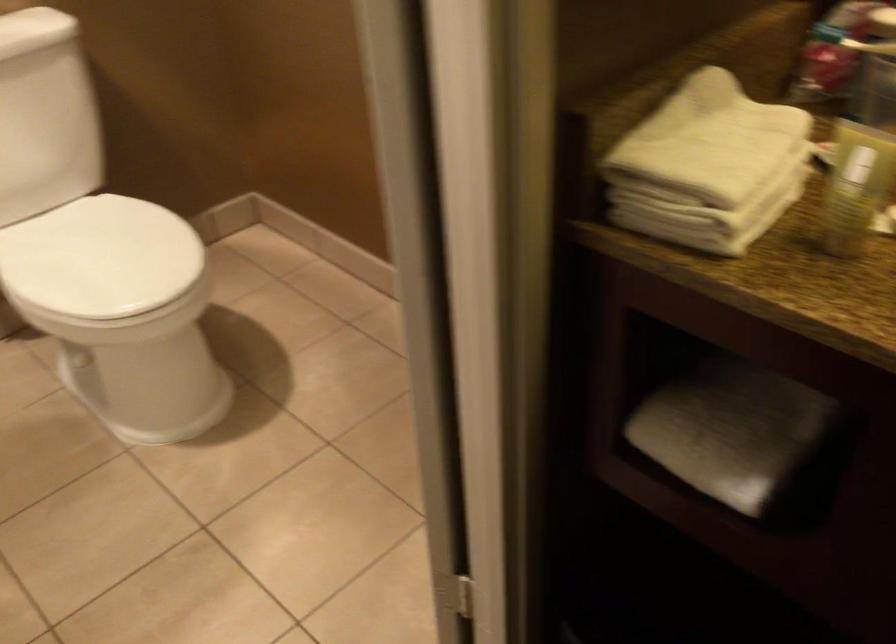
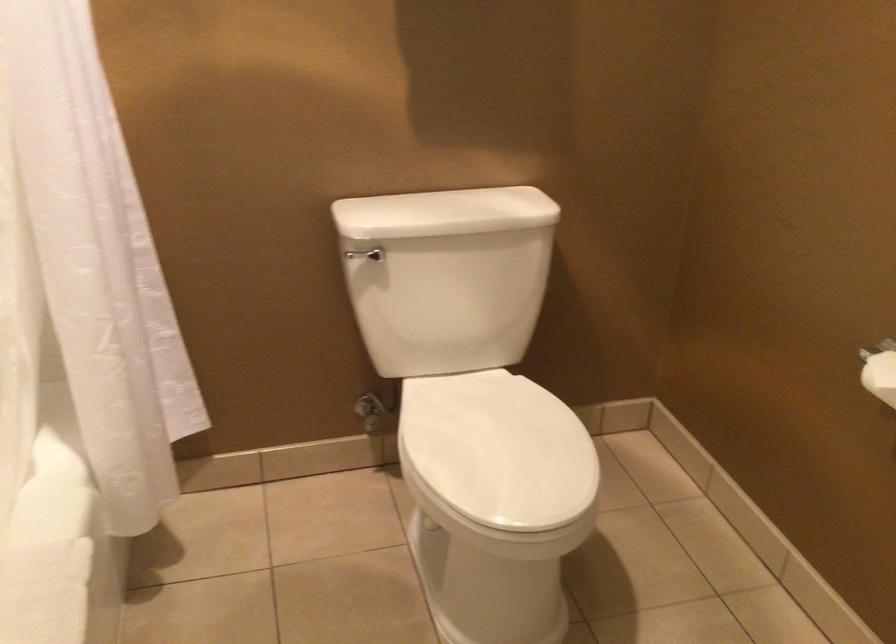
In the second image, find the point that corresponds to (x=104, y=256) in the first image.

(498, 450)